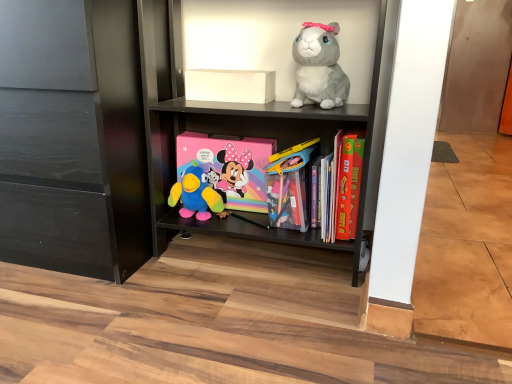
You are a GUI agent. You are given a task and a screenshot of the screen. Output one action in this format:
    pyautogui.click(x=<x>, y=<y>)
    Task: Click on the plush blue bird at center, the 3th toy viewed from the right
    The width and height of the screenshot is (512, 384).
    Given the screenshot: What is the action you would take?
    pyautogui.click(x=197, y=195)

What is the approximate height of translucent plastic container at center, the 2th toy positioned from the right?

translucent plastic container at center, the 2th toy positioned from the right, is 26.00 centimeters in height.

Describe the element at coordinates (265, 137) in the screenshot. This screenshot has width=512, height=384. I see `matte black shelf at center` at that location.

The height and width of the screenshot is (384, 512). What do you see at coordinates (339, 187) in the screenshot?
I see `hardcover book at center right` at bounding box center [339, 187].

Locate an element on the screen. fluffy gray plush rabbit at upper right, which ranks as the third toy in left-to-right order is located at coordinates (319, 67).

The width and height of the screenshot is (512, 384). I want to click on pastel matte minnie mouse comic book at center, so click(229, 167).

Considering the relative positions of hardcover book at center right and plush blue bird at center, the 3th toy viewed from the right, in the image provided, is hardcover book at center right to the left or to the right of plush blue bird at center, the 3th toy viewed from the right,?

From the image, it's evident that hardcover book at center right is to the right of plush blue bird at center, the 3th toy viewed from the right.

Which is farther, (353,173) or (192,168)?

The point (192,168) is behind.

Are hardcover book at center right and plush blue bird at center, the 3th toy viewed from the right, located far from each other?

That's not correct — hardcover book at center right is a little close to plush blue bird at center, the 3th toy viewed from the right.

Can you tell me how much hardcover book at center right and plush blue bird at center, the 3th toy viewed from the right, differ in facing direction?

They differ by 3.17e-05 degrees in their facing directions.

Which object is positioned more to the left, black matte cabinet at lower left or translucent plastic container at center, the 2th toy positioned from the right?

Positioned to the left is black matte cabinet at lower left.

What's the angular difference between black matte cabinet at lower left and translucent plastic container at center, the 2th toy positioned from the right,'s facing directions?

The angular difference between black matte cabinet at lower left and translucent plastic container at center, the 2th toy positioned from the right, is 5.69e-05 degrees.

Is black matte cabinet at lower left taller than translucent plastic container at center, the 2th toy positioned from the right?

Yes, black matte cabinet at lower left is taller than translucent plastic container at center, the 2th toy positioned from the right.

Do you think matte black shelf at center is within plush blue bird at center, the 1th toy from the left, or outside of it?

matte black shelf at center is spatially situated outside plush blue bird at center, the 1th toy from the left.

Considering the positions of objects matte black shelf at center and plush blue bird at center, the 3th toy viewed from the right, in the image provided, who is behind, matte black shelf at center or plush blue bird at center, the 3th toy viewed from the right,?

plush blue bird at center, the 3th toy viewed from the right, is more distant.

Is point (203, 103) closer to camera compared to point (191, 213)?

Yes, point (203, 103) is closer to viewer.

Is matte black shelf at center not near plush blue bird at center, the 3th toy viewed from the right?

matte black shelf at center is near plush blue bird at center, the 3th toy viewed from the right, not far away.

Is black matte cabinet at lower left behind pastel matte minnie mouse comic book at center?

No, black matte cabinet at lower left is closer to the viewer.

I want to click on cabinetry in front of the pastel matte minnie mouse comic book at center, so click(79, 155).

From a real-world perspective, which is physically above, black matte cabinet at lower left or pastel matte minnie mouse comic book at center?

black matte cabinet at lower left.

Is fluffy gray plush rabbit at upper right, the 1th toy viewed from the right, positioned before matte black shelf at center?

No, fluffy gray plush rabbit at upper right, the 1th toy viewed from the right, is further to the viewer.

From the image's perspective, is fluffy gray plush rabbit at upper right, the 1th toy viewed from the right, under matte black shelf at center?

Incorrect, from the image's perspective, fluffy gray plush rabbit at upper right, the 1th toy viewed from the right, is higher than matte black shelf at center.

From a real-world perspective, which is physically above, fluffy gray plush rabbit at upper right, the 1th toy viewed from the right, or matte black shelf at center?

In real-world perspective, fluffy gray plush rabbit at upper right, the 1th toy viewed from the right, is above.

This screenshot has width=512, height=384. I want to click on the 1st toy behind the matte black shelf at center, so click(x=319, y=67).

Is translucent plastic container at center, which is the second toy from left to right, looking in the opposite direction of matte black shelf at center?

Yes, translucent plastic container at center, which is the second toy from left to right,'s orientation is away from matte black shelf at center.

Would you say matte black shelf at center is part of translucent plastic container at center, the 2th toy positioned from the right,'s contents?

No, matte black shelf at center is not inside translucent plastic container at center, the 2th toy positioned from the right.

From a real-world perspective, which toy is the 1st one underneath the matte black shelf at center? Please provide its 2D coordinates.

[(289, 186)]

Which of these two, hardcover book at center right or translucent plastic container at center, which is the second toy from left to right, is smaller?

With smaller size is translucent plastic container at center, which is the second toy from left to right.

Considering the relative positions of hardcover book at center right and translucent plastic container at center, the 2th toy positioned from the right, in the image provided, is hardcover book at center right to the left of translucent plastic container at center, the 2th toy positioned from the right, from the viewer's perspective?

In fact, hardcover book at center right is to the right of translucent plastic container at center, the 2th toy positioned from the right.

Does point (342, 220) come behind point (291, 172)?

No, it is not.

Does hardcover book at center right have a lesser width compared to translucent plastic container at center, the 2th toy positioned from the right?

Incorrect, the width of hardcover book at center right is not less than that of translucent plastic container at center, the 2th toy positioned from the right.

Identify the location of book above the plush blue bird at center, the 3th toy viewed from the right (from the image's perspective). This screenshot has height=384, width=512. (339, 187).

What are the coordinates of `cabinetry in front of the translucent plastic container at center, which is the second toy from left to right` in the screenshot? It's located at click(79, 155).

Based on their spatial positions, is hardcover book at center right or translucent plastic container at center, which is the second toy from left to right, closer to fluffy gray plush rabbit at upper right, which ranks as the third toy in left-to-right order?

hardcover book at center right is closer to fluffy gray plush rabbit at upper right, which ranks as the third toy in left-to-right order.

Considering their positions, is plush blue bird at center, the 3th toy viewed from the right, positioned closer to matte black shelf at center than fluffy gray plush rabbit at upper right, which ranks as the third toy in left-to-right order?

fluffy gray plush rabbit at upper right, which ranks as the third toy in left-to-right order, lies closer to matte black shelf at center than the other object.

Considering their positions, is plush blue bird at center, the 1th toy from the left, positioned further to hardcover book at center right than translucent plastic container at center, which is the second toy from left to right?

Among the two, plush blue bird at center, the 1th toy from the left, is located further to hardcover book at center right.

Which object lies further to the anchor point translucent plastic container at center, the 2th toy positioned from the right, matte black shelf at center or hardcover book at center right?

matte black shelf at center lies further to translucent plastic container at center, the 2th toy positioned from the right, than the other object.

From the image, which object appears to be farther from black matte cabinet at lower left, translucent plastic container at center, which is the second toy from left to right, or hardcover book at center right?

hardcover book at center right.

Estimate the real-world distances between objects in this image. Which object is closer to translucent plastic container at center, which is the second toy from left to right, hardcover book at center right or fluffy gray plush rabbit at upper right, the 1th toy viewed from the right?

hardcover book at center right is positioned closer to the anchor translucent plastic container at center, which is the second toy from left to right.

Estimate the real-world distances between objects in this image. Which object is further from pastel matte minnie mouse comic book at center, white matte box at upper center or hardcover book at center right?

hardcover book at center right is positioned further to the anchor pastel matte minnie mouse comic book at center.

Estimate the real-world distances between objects in this image. Which object is further from black matte cabinet at lower left, white matte box at upper center or hardcover book at center right?

The object further to black matte cabinet at lower left is hardcover book at center right.

At what (x,y) coordinates should I click in order to perform the action: click on box between black matte cabinet at lower left and hardcover book at center right. Please return your answer as a coordinate pair (x, y). The width and height of the screenshot is (512, 384). Looking at the image, I should click on [230, 85].

Locate an element on the screen. box that lies between fluffy gray plush rabbit at upper right, the 1th toy viewed from the right, and pastel matte minnie mouse comic book at center from top to bottom is located at coordinates (230, 85).

Identify the location of comic book between white matte box at upper center and translucent plastic container at center, which is the second toy from left to right, in the vertical direction. (229, 167).

Identify the location of box between black matte cabinet at lower left and matte black shelf at center from left to right. (230, 85).